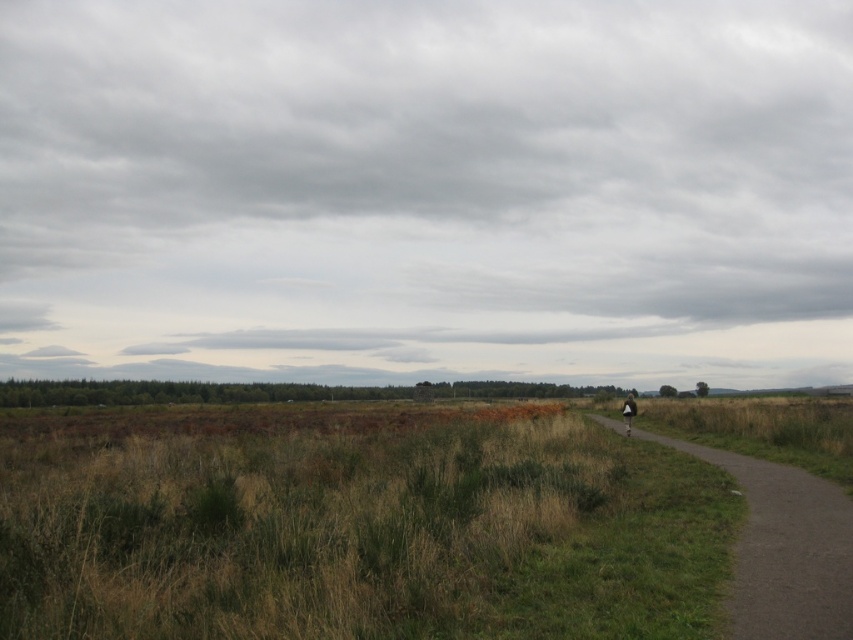
Question: Is dull gray asphalt path at right above white fabric bag at center-right?

Choices:
 (A) no
 (B) yes

Answer: (B)

Question: Does dull gray asphalt path at right have a smaller size compared to white fabric bag at center-right?

Choices:
 (A) no
 (B) yes

Answer: (B)

Question: Which of the following is the closest to the observer?

Choices:
 (A) (622, 416)
 (B) (775, 636)

Answer: (B)

Question: Which point is farther to the camera?

Choices:
 (A) white fabric bag at center-right
 (B) dull gray asphalt path at right

Answer: (A)

Question: Considering the relative positions of dull gray asphalt path at right and white fabric bag at center-right in the image provided, where is dull gray asphalt path at right located with respect to white fabric bag at center-right?

Choices:
 (A) below
 (B) above

Answer: (B)